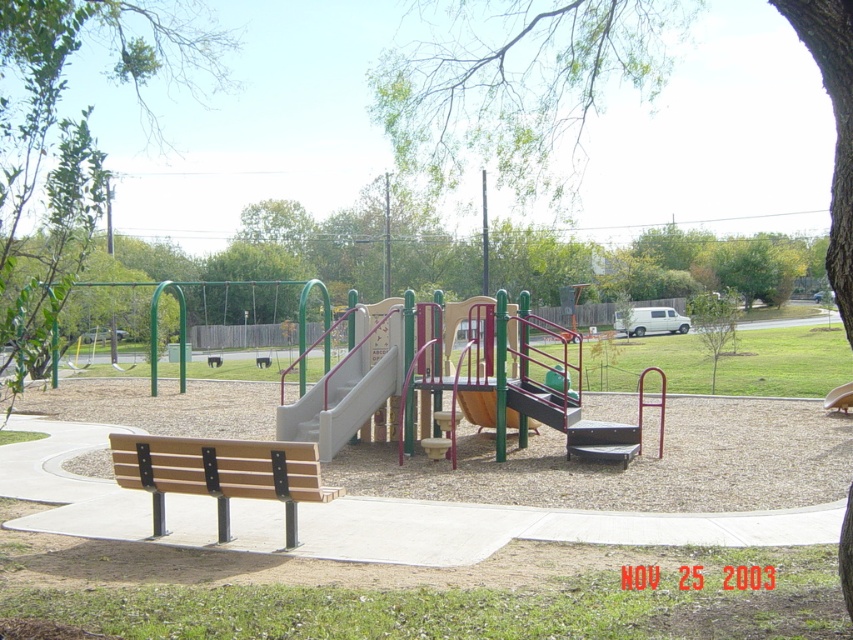
From the picture: Does green leafy tree at upper center have a lesser height compared to green matte tree at upper center?

No.

Is green leafy tree at upper center further to the viewer compared to green matte tree at upper center?

Yes.

This screenshot has height=640, width=853. Describe the element at coordinates (514, 77) in the screenshot. I see `green leafy tree at upper center` at that location.

What are the coordinates of `green leafy tree at upper center` in the screenshot? It's located at (514, 77).

Is wooden bench at lower left further to the viewer compared to white plastic slide at center?

No, it is in front of white plastic slide at center.

Is point (292, 474) farther from camera compared to point (397, 378)?

That is False.

Locate an element on the screen. wooden bench at lower left is located at coordinates (219, 474).

How far apart are green leafy tree at upper left and white plastic slide at center?

green leafy tree at upper left is 8.45 meters from white plastic slide at center.

Which is below, green leafy tree at upper left or white plastic slide at center?

white plastic slide at center is below.

Who is more forward, (61, 131) or (358, 381)?

Positioned in front is point (358, 381).

Locate an element on the screen. Image resolution: width=853 pixels, height=640 pixels. green leafy tree at upper left is located at coordinates (68, 148).